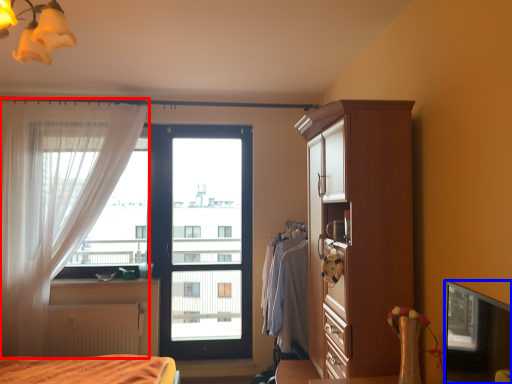
Question: Which object is further to the camera taking this photo, curtain (highlighted by a red box) or window screen (highlighted by a blue box)?

Choices:
 (A) curtain
 (B) window screen

Answer: (A)